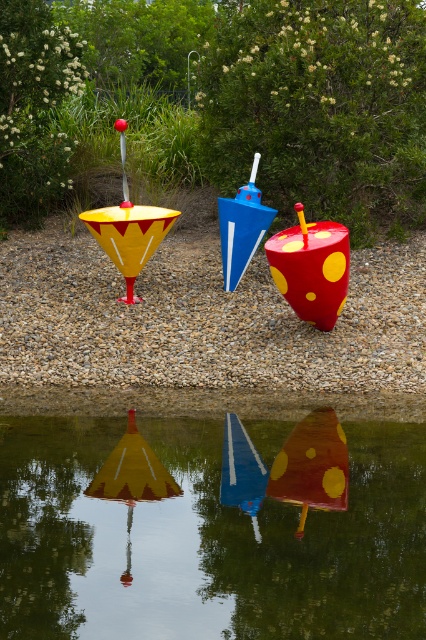
Question: Which object is positioned farthest from the glossy water at center?

Choices:
 (A) blue glossy cone at center
 (B) matte yellow and red polka dot cone at center
 (C) polka dot plastic bucket at center
 (D) blue glossy sign at center

Answer: (A)

Question: Does matte yellow and red polka dot cone at center have a lesser width compared to blue glossy sign at center?

Choices:
 (A) no
 (B) yes

Answer: (A)

Question: Can you confirm if glossy water at center is bigger than polka dot plastic bucket at center?

Choices:
 (A) yes
 (B) no

Answer: (A)

Question: Based on their relative distances, which object is farther from the polka dot plastic bucket at center?

Choices:
 (A) matte yellow and red polka dot cone at center
 (B) glossy water at center

Answer: (B)

Question: Among these points, which one is nearest to the camera?

Choices:
 (A) (230, 486)
 (B) (106, 472)
 (C) (258, 241)

Answer: (A)

Question: Considering the relative positions of matte yellow and red plastic umbrella at center and yellow striped cone at center in the image provided, where is matte yellow and red plastic umbrella at center located with respect to yellow striped cone at center?

Choices:
 (A) below
 (B) above

Answer: (B)